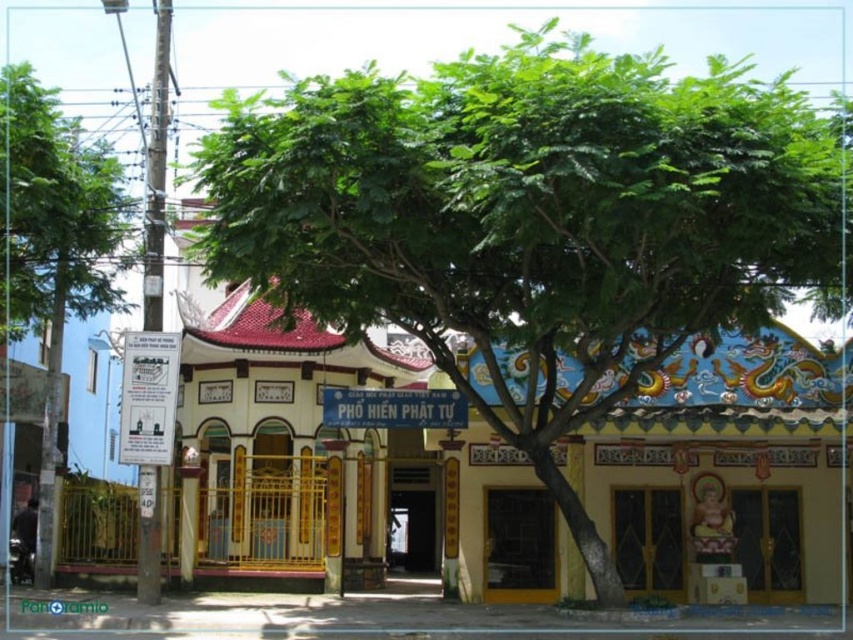
You are standing at the entrance of the temple and want to take a photo of the building without the green leafy tree at center blocking the view. Based on your current position, which direction should you move to ensure the tree is no longer in the frame?

To avoid the green leafy tree at center blocking the view, you should move to the right or left since the tree is positioned at the center of the image. Moving sideways will shift the tree out of the frame, allowing a clear view of the temple.